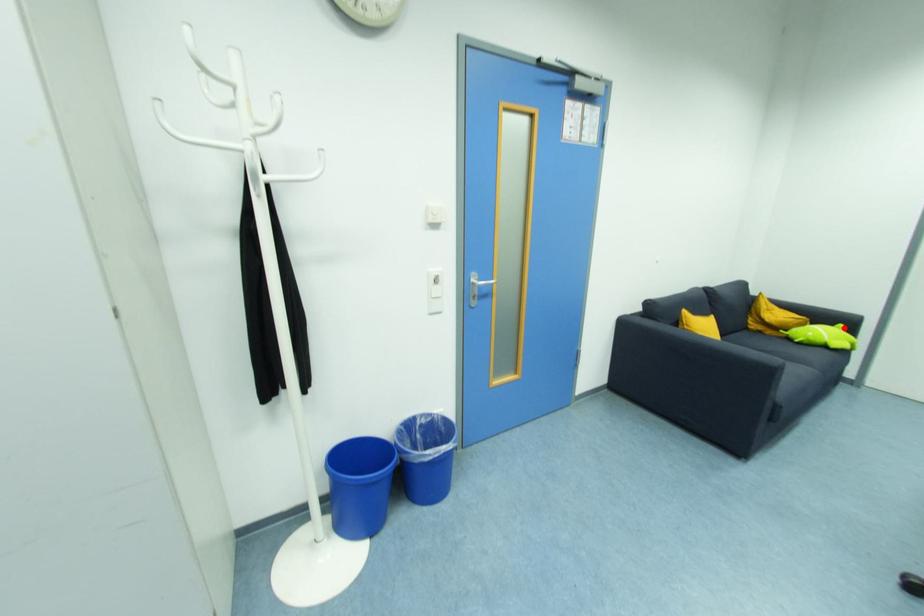
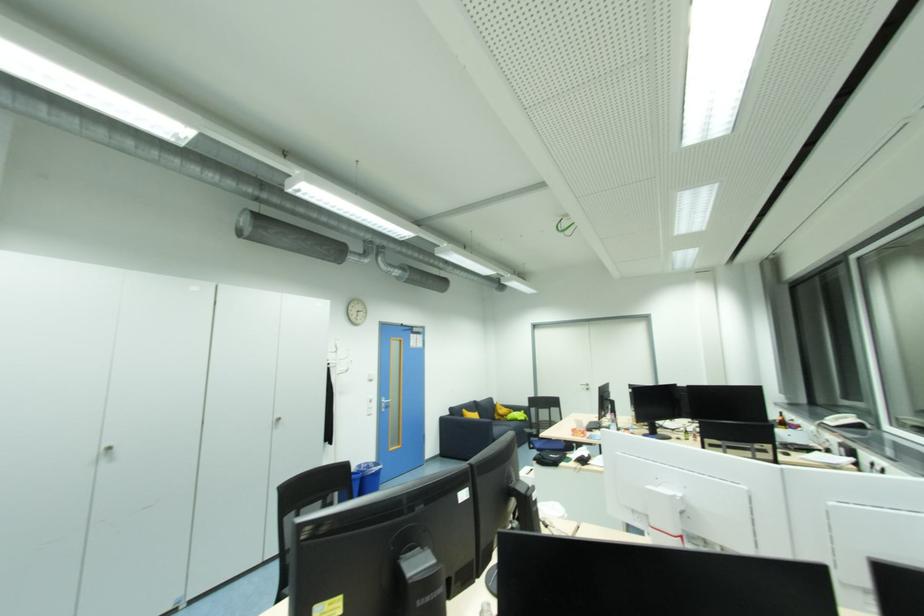
Find the pixel in the second image that matches the highlighted location in the first image.

(526, 413)